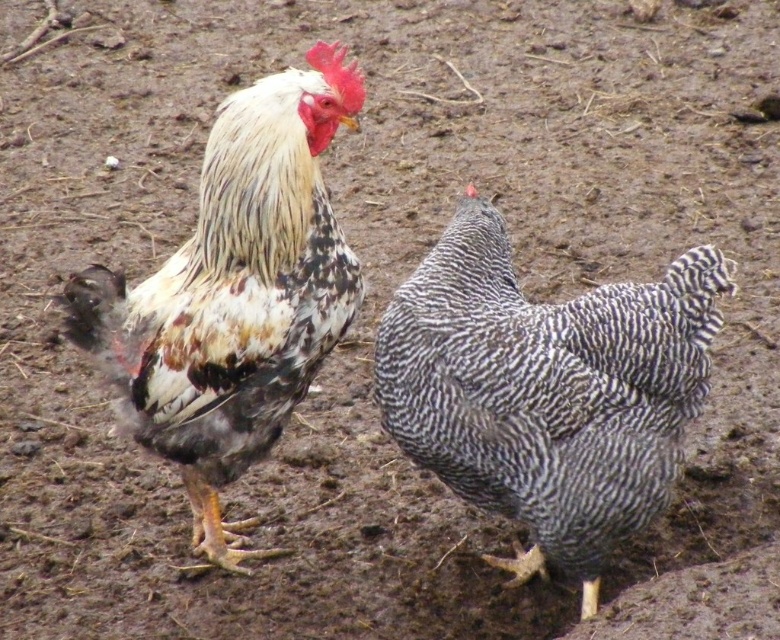
Between point (403, 355) and point (256, 212), which one is positioned behind?

The point (403, 355) is behind.

Based on the photo, is speckled feathered hen at center to the right of speckled feathered rooster at center from the viewer's perspective?

Indeed, speckled feathered hen at center is positioned on the right side of speckled feathered rooster at center.

In the scene shown: Who is more forward, (562,490) or (295,99)?

Positioned in front is point (295,99).

This screenshot has height=640, width=780. I want to click on speckled feathered hen at center, so click(x=546, y=390).